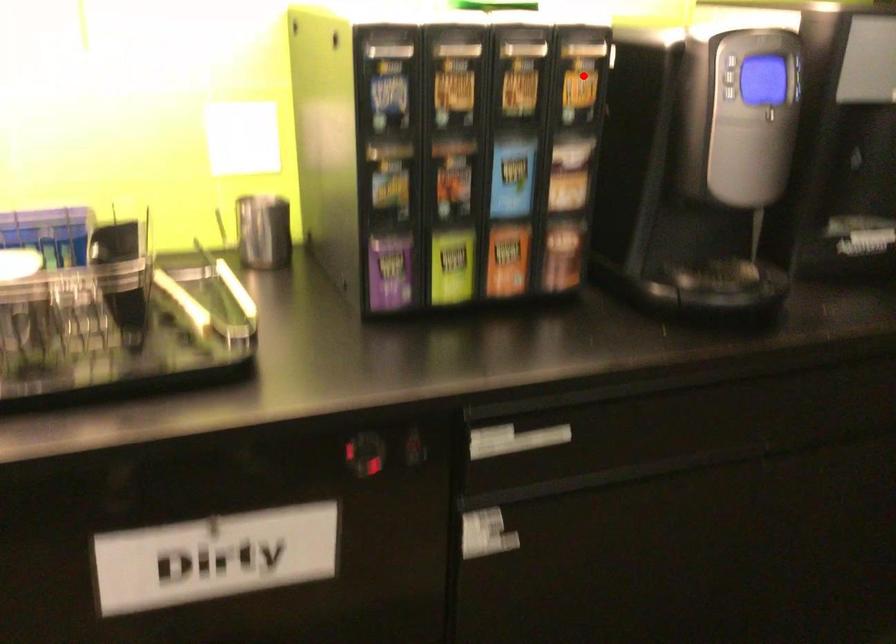
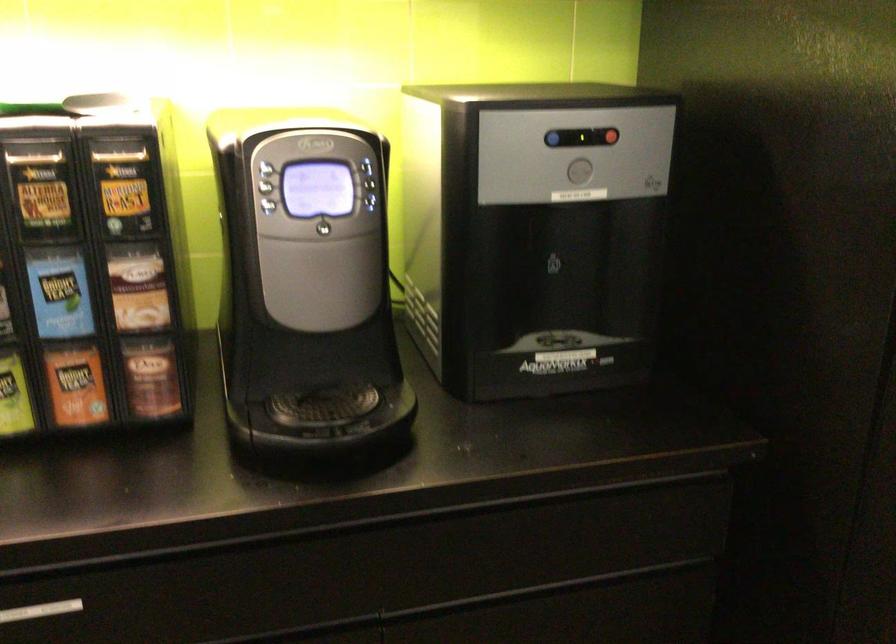
Question: A red point is marked in image1. In image2, is the corresponding 3D point closer to the camera or farther? Reply with the corresponding letter.

Choices:
 (A) The corresponding 3D point is closer.
 (B) The corresponding 3D point is farther.

Answer: (A)